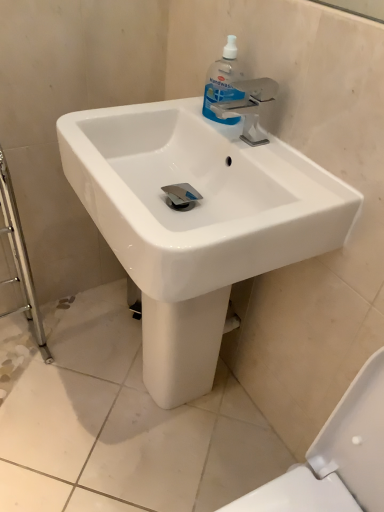
Question: Does clear plastic handwash at upper center appear on the right side of white glossy sink at center?

Choices:
 (A) yes
 (B) no

Answer: (A)

Question: Is the position of clear plastic handwash at upper center more distant than that of white glossy sink at center?

Choices:
 (A) yes
 (B) no

Answer: (A)

Question: Is white glossy sink at center inside clear plastic handwash at upper center?

Choices:
 (A) yes
 (B) no

Answer: (B)

Question: Can you confirm if clear plastic handwash at upper center is wider than white glossy sink at center?

Choices:
 (A) no
 (B) yes

Answer: (A)

Question: Is clear plastic handwash at upper center not inside white glossy sink at center?

Choices:
 (A) no
 (B) yes

Answer: (A)

Question: From the image's perspective, is clear plastic handwash at upper center on top of white glossy sink at center?

Choices:
 (A) yes
 (B) no

Answer: (A)

Question: Is white glossy sink at center not within clear plastic handwash at upper center?

Choices:
 (A) no
 (B) yes

Answer: (B)

Question: From the image's perspective, is white glossy sink at center over clear plastic handwash at upper center?

Choices:
 (A) yes
 (B) no

Answer: (B)

Question: Would you consider white glossy sink at center to be distant from clear plastic handwash at upper center?

Choices:
 (A) yes
 (B) no

Answer: (B)

Question: Is white glossy sink at center aimed at clear plastic handwash at upper center?

Choices:
 (A) yes
 (B) no

Answer: (B)

Question: Can you confirm if white glossy sink at center is thinner than clear plastic handwash at upper center?

Choices:
 (A) no
 (B) yes

Answer: (A)

Question: From a real-world perspective, is white glossy sink at center positioned over clear plastic handwash at upper center based on gravity?

Choices:
 (A) yes
 (B) no

Answer: (B)

Question: Considering the positions of clear plastic handwash at upper center and white glossy sink at center in the image, is clear plastic handwash at upper center wider or thinner than white glossy sink at center?

Choices:
 (A) wide
 (B) thin

Answer: (B)